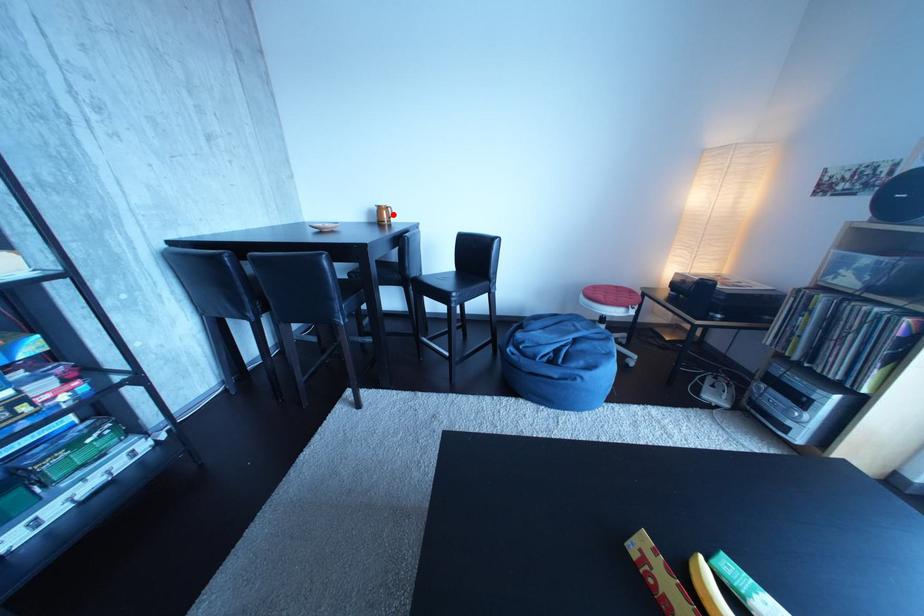
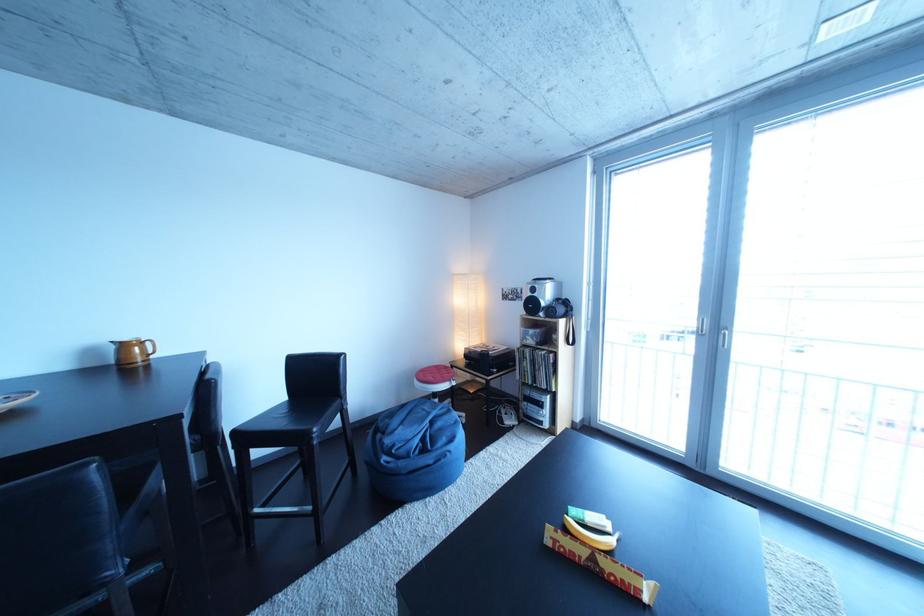
The point at the highlighted location is marked in the first image. Where is the corresponding point in the second image?

(138, 351)